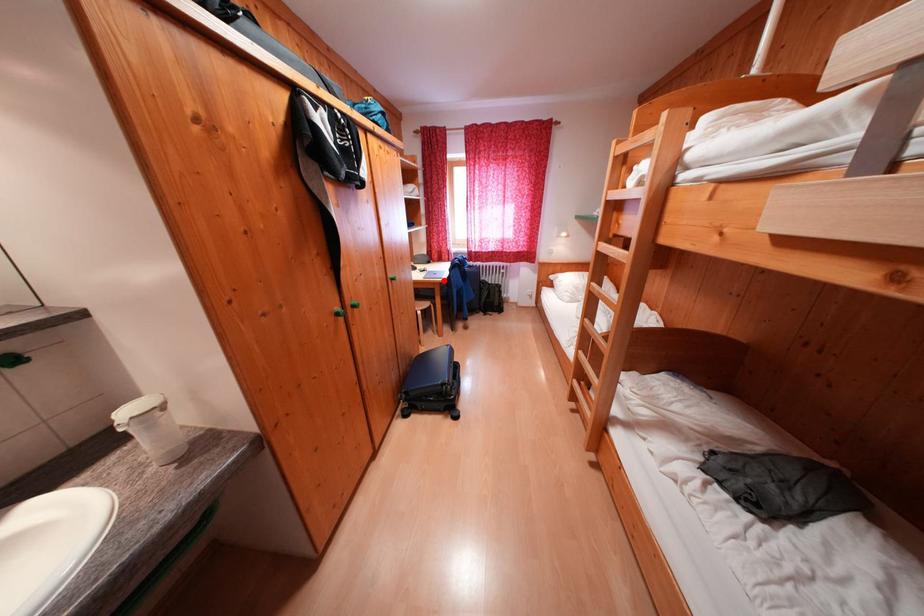
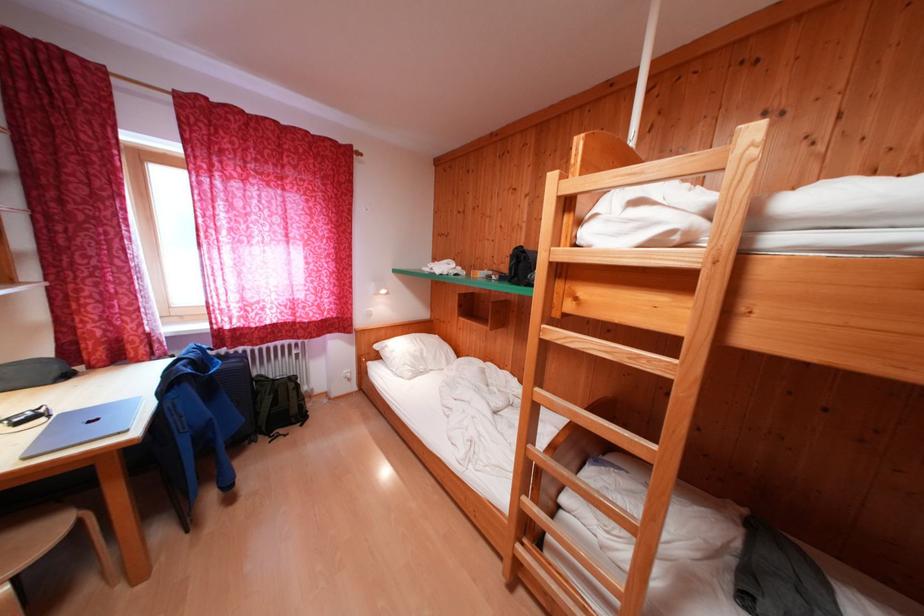
Locate, in the second image, the point that corresponds to the highlighted location in the first image.

(104, 434)